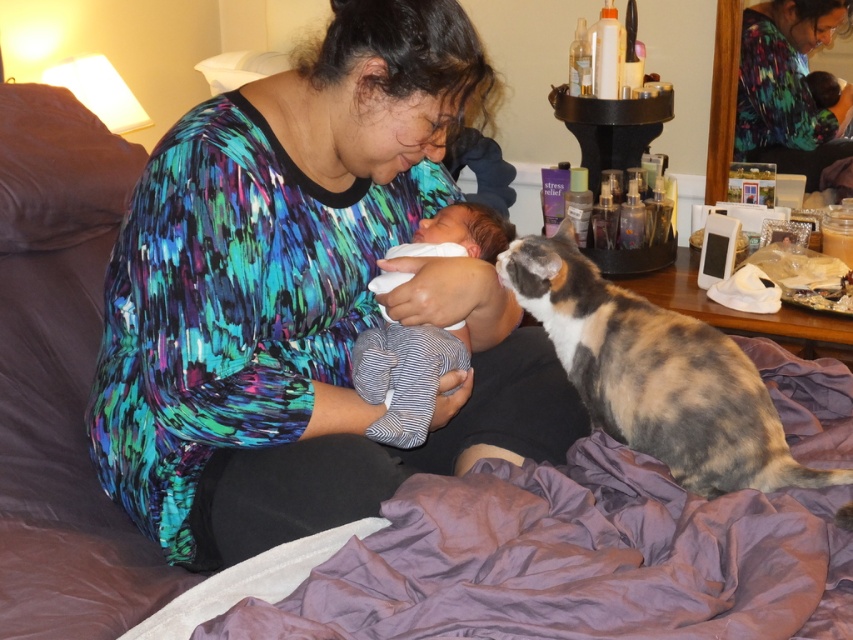
This screenshot has height=640, width=853. Describe the element at coordinates (573, 561) in the screenshot. I see `purple satin blanket at lower center` at that location.

Between purple satin blanket at lower center and multicolored printed shirt at upper center, which one has more height?

multicolored printed shirt at upper center

Locate an element on the screen. This screenshot has width=853, height=640. purple satin blanket at lower center is located at coordinates (573, 561).

In order to click on purple satin blanket at lower center in this screenshot , I will do `click(573, 561)`.

Which of these two, purple satin blanket at lower center or calico fur cat at right, stands shorter?

purple satin blanket at lower center is shorter.

Can you confirm if purple satin blanket at lower center is shorter than calico fur cat at right?

Yes, purple satin blanket at lower center is shorter than calico fur cat at right.

The width and height of the screenshot is (853, 640). Find the location of `purple satin blanket at lower center`. purple satin blanket at lower center is located at coordinates (573, 561).

Does purple satin blanket at lower center lie behind white soft baby at center?

No.

Which of these two, purple satin blanket at lower center or white soft baby at center, stands taller?

white soft baby at center is taller.

You are a GUI agent. You are given a task and a screenshot of the screen. Output one action in this format:
    pyautogui.click(x=<x>, y=<y>)
    Task: Click on the purple satin blanket at lower center
    The image size is (853, 640).
    Given the screenshot: What is the action you would take?
    pyautogui.click(x=573, y=561)